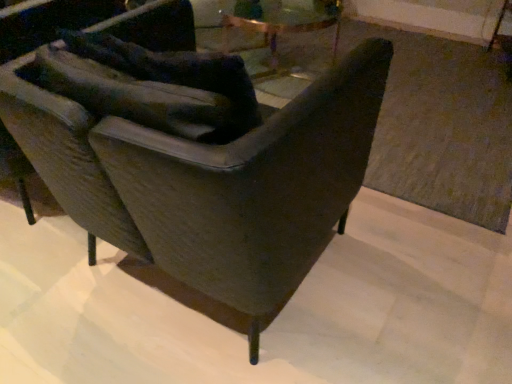
This screenshot has width=512, height=384. In order to click on vacant area to the right of dark gray leather rocking chair at center in this screenshot , I will do `click(402, 287)`.